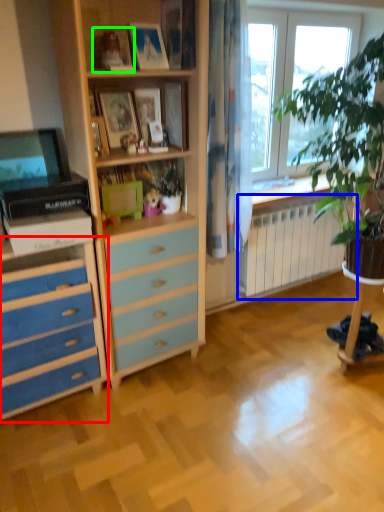
Question: Considering the real-world distances, which object is closest to chest of drawers (highlighted by a red box)? radiator (highlighted by a blue box) or picture frame (highlighted by a green box).

Choices:
 (A) radiator
 (B) picture frame

Answer: (B)